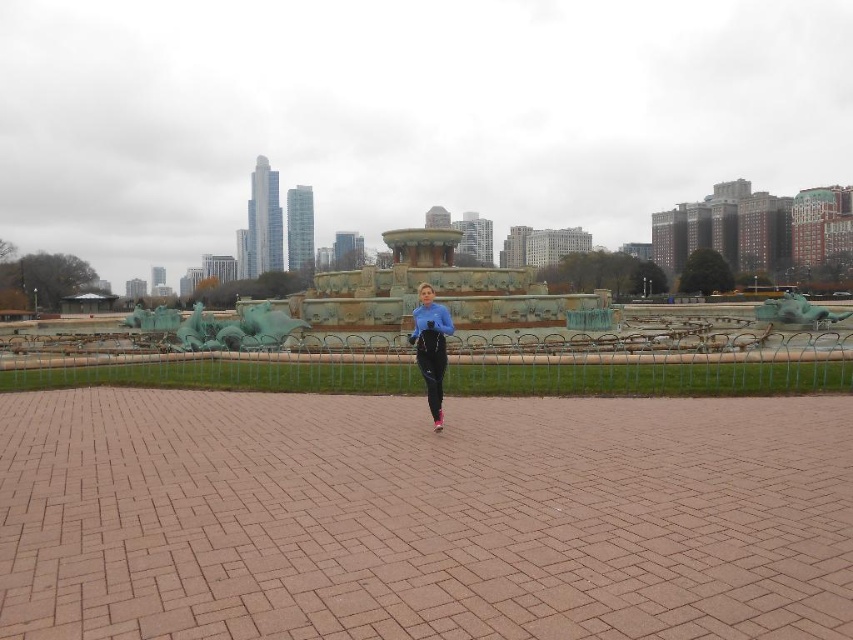
Who is positioned more to the right, green patina fountain at center or blue fabric pants at center?

green patina fountain at center

Is green patina fountain at center to the right of blue fabric pants at center from the viewer's perspective?

Correct, you'll find green patina fountain at center to the right of blue fabric pants at center.

Who is more distant from viewer, [410,234] or [436,336]?

The point [410,234] is behind.

You are a GUI agent. You are given a task and a screenshot of the screen. Output one action in this format:
    pyautogui.click(x=<x>, y=<y>)
    Task: Click on the green patina fountain at center
    The height and width of the screenshot is (640, 853).
    Given the screenshot: What is the action you would take?
    pyautogui.click(x=433, y=291)

Can you confirm if brown brick path at center is wider than green patina fountain at center?

No, brown brick path at center is not wider than green patina fountain at center.

Between point (483, 508) and point (479, 300), which one is positioned in front?

Point (483, 508)

Where is `brown brick path at center`? brown brick path at center is located at coordinates (422, 516).

Is brown brick path at center behind blue fabric pants at center?

No, brown brick path at center is in front of blue fabric pants at center.

Is brown brick path at center wider than blue fabric pants at center?

Correct, the width of brown brick path at center exceeds that of blue fabric pants at center.

Find the location of a particular element. The height and width of the screenshot is (640, 853). brown brick path at center is located at coordinates (422, 516).